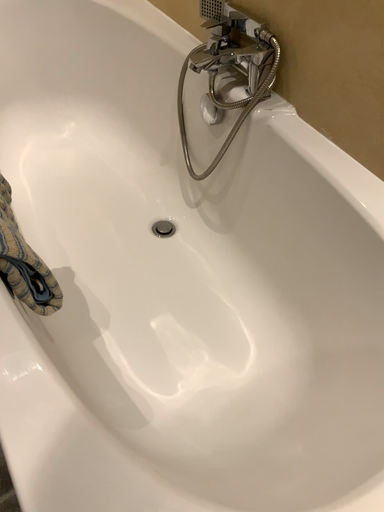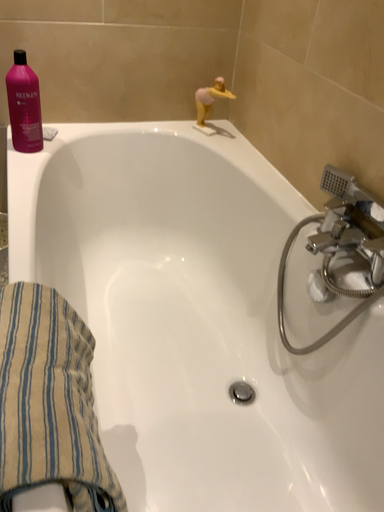
Question: How did the camera likely rotate when shooting the video?

Choices:
 (A) rotated downward
 (B) rotated upward

Answer: (B)